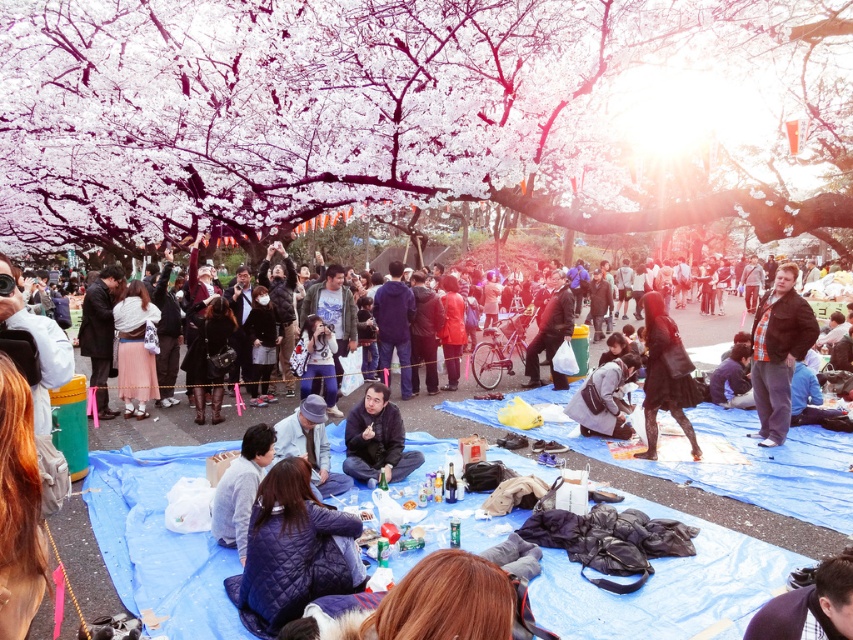
Question: Which is farther from the dark brown leather jacket at center?

Choices:
 (A) checkered shirt jacket at right
 (B) matte gray beanie at center
 (C) black matte dress at center

Answer: (B)

Question: Can you confirm if white blossoming tree at center is positioned above matte black jacket at center?

Choices:
 (A) yes
 (B) no

Answer: (A)

Question: Which object appears closest to the camera in this image?

Choices:
 (A) dark blue fabric at center
 (B) white blossoming tree at center
 (C) checkered shirt jacket at right
 (D) dark purple jacket at lower right

Answer: (D)

Question: Does dark blue fabric at center have a greater width compared to dark brown leather jacket at center?

Choices:
 (A) no
 (B) yes

Answer: (A)

Question: Is quilted blue jacket at center wider than matte gray beanie at center?

Choices:
 (A) yes
 (B) no

Answer: (A)

Question: Which point is closer to the camera taking this photo?

Choices:
 (A) (260, 424)
 (B) (822, 570)
 (C) (775, 390)
 (D) (570, 324)

Answer: (B)